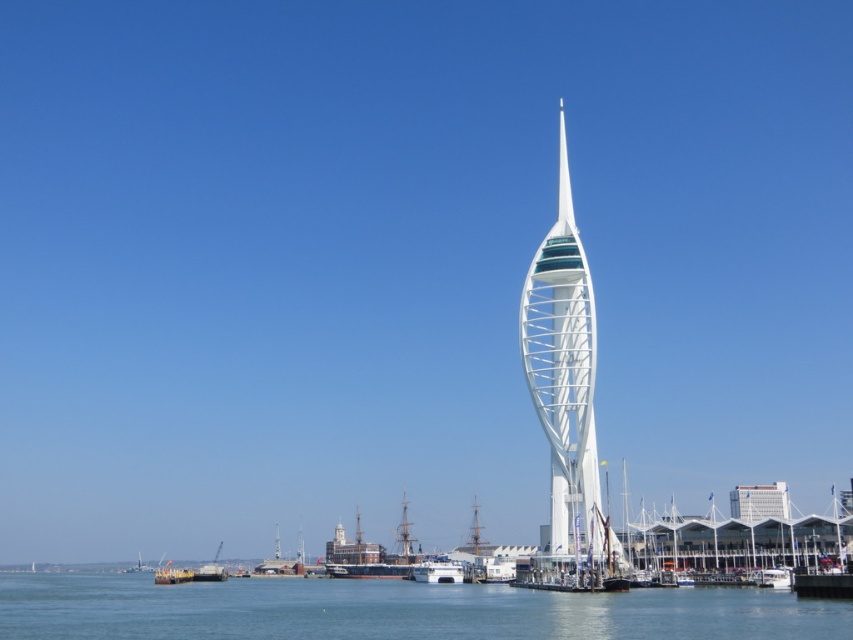
Question: Which point is closer to the camera?

Choices:
 (A) clear blue water at lower center
 (B) white glossy boat at lower left
 (C) white glossy spire at center
 (D) white glossy boat at center

Answer: (A)

Question: Does white glass tower at center have a greater width compared to white glossy boat at lower left?

Choices:
 (A) yes
 (B) no

Answer: (B)

Question: Which of these objects is positioned closest to the white wooden boat at lower left?

Choices:
 (A) white glossy boat at lower left
 (B) white glossy boat at center
 (C) white glossy spire at center

Answer: (A)

Question: Can you confirm if white glossy boat at center is wider than white glossy boat at lower left?

Choices:
 (A) no
 (B) yes

Answer: (A)

Question: From the image, what is the correct spatial relationship of white glass tower at center in relation to white wooden boat at lower left?

Choices:
 (A) right
 (B) left

Answer: (A)

Question: Among these objects, which one is farthest from the camera?

Choices:
 (A) white wooden boat at lower left
 (B) white glossy spire at center

Answer: (A)